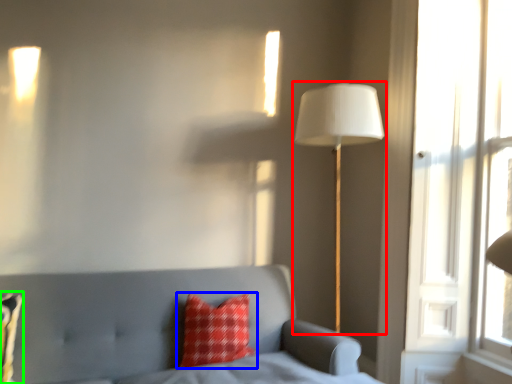
Question: Which object is the farthest from lamp (highlighted by a red box)? Choose among these: pillow (highlighted by a blue box) or pillow (highlighted by a green box).

Choices:
 (A) pillow
 (B) pillow

Answer: (B)